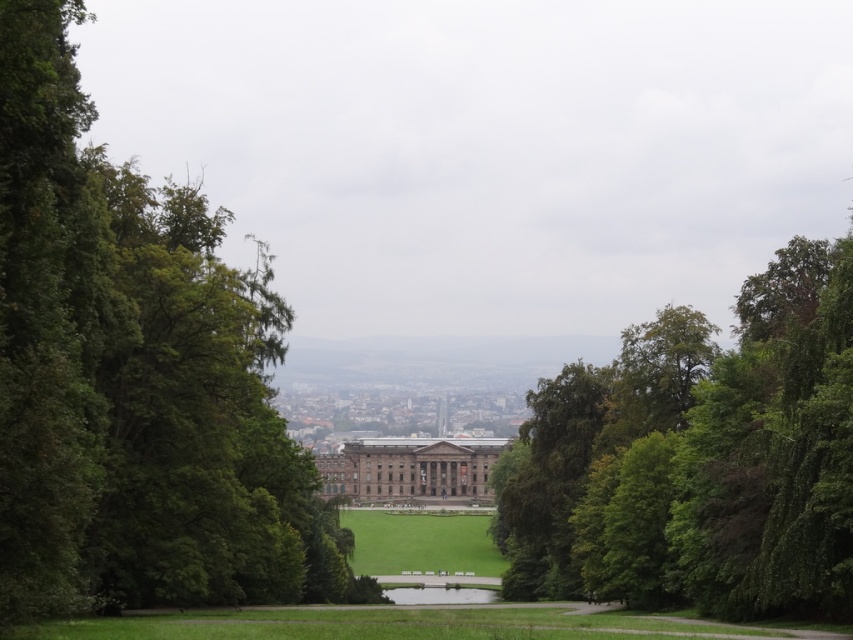
Between green leafy tree at left and green leafy tree at center, which one is positioned higher?

green leafy tree at left

Who is taller, green leafy tree at left or green leafy tree at center?

With more height is green leafy tree at left.

Between point (51, 204) and point (838, 321), which one is positioned behind?

The point (838, 321) is more distant.

In order to click on green leafy tree at left in this screenshot , I will do `click(134, 378)`.

Does green leafy tree at left have a lesser height compared to brown stone palace at center?

Incorrect, green leafy tree at left's height does not fall short of brown stone palace at center's.

Is point (3, 116) positioned after point (397, 480)?

No.

Who is more forward, (111,262) or (410,461)?

Point (111,262) is in front.

Where is `green leafy tree at left`? green leafy tree at left is located at coordinates (134, 378).

Can you confirm if green leafy tree at center is shorter than brown stone palace at center?

No, green leafy tree at center is not shorter than brown stone palace at center.

I want to click on green leafy tree at center, so click(700, 458).

Between point (828, 256) and point (355, 483), which one is positioned behind?

The point (355, 483) is behind.

Where is `green leafy tree at center`? This screenshot has width=853, height=640. green leafy tree at center is located at coordinates (700, 458).